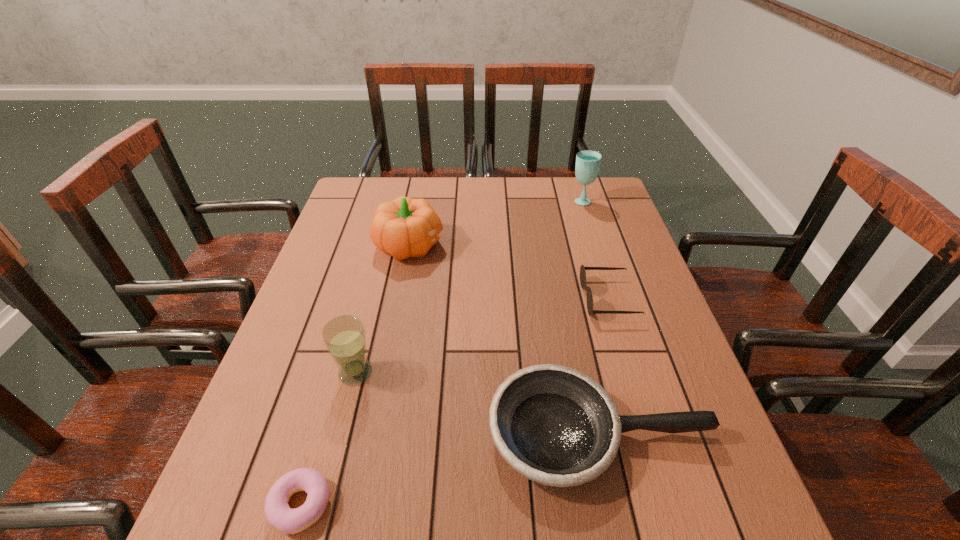
Locate which object is the fifth closest to the shortest object. Please provide its 2D coordinates. Your answer should be formatted as a tuple, i.e. [(x, y)], where the tuple contains the x and y coordinates of a point satisfying the conditions above.

[(588, 162)]

Locate which object ranks fifth in proximity to the fifth nearest object. Please provide its 2D coordinates. Your answer should be formatted as a tuple, i.e. [(x, y)], where the tuple contains the x and y coordinates of a point satisfying the conditions above.

[(278, 513)]

Where is `vacant region that satisfies the following two spatial constraints: 1. on the handle side of the frying pan; 2. on the front side of the shortest object`? The image size is (960, 540). vacant region that satisfies the following two spatial constraints: 1. on the handle side of the frying pan; 2. on the front side of the shortest object is located at coordinates pyautogui.click(x=616, y=505).

Find the location of a particular element. The height and width of the screenshot is (540, 960). vacant region that satisfies the following two spatial constraints: 1. on the back side of the farthest object; 2. on the right side of the doughnut is located at coordinates [x=388, y=200].

Locate an element on the screen. The height and width of the screenshot is (540, 960). vacant space that satisfies the following two spatial constraints: 1. on the back side of the shortest object; 2. on the right side of the farther glass is located at coordinates (388, 200).